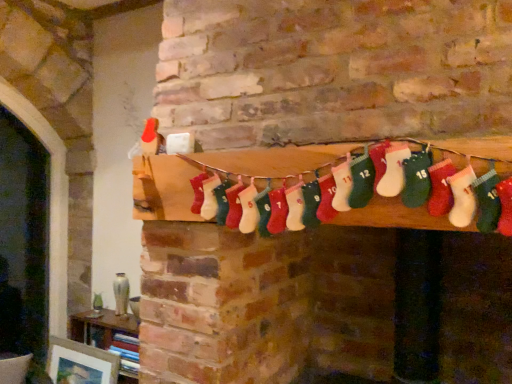
The image size is (512, 384). In order to click on free space above red knitted stocking at center (from a real-world perspective) in this screenshot , I will do `click(296, 148)`.